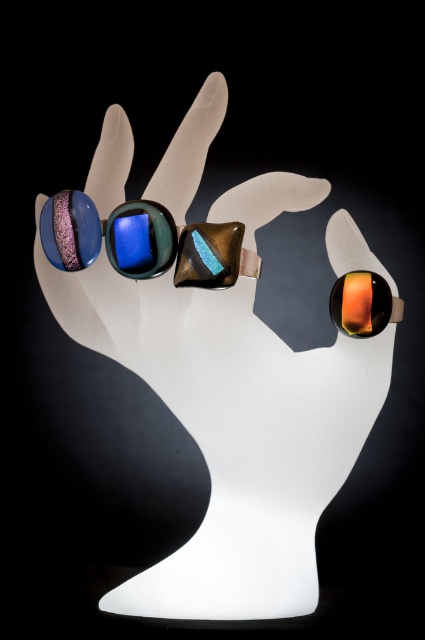
You are standing in front of the mannequin hand displaying rings. There are two points marked on the hand. The first point is at coordinates point (116, 225) and the second point is at point (376, 285). Which point is closer to you?

Point (116, 225) is in front of point (376, 285), so it is closer to you.

You are a jeweler examining the display of rings on the mannequin hand. You notice the shiny blue glass goggles at center and the orange glossy ring at upper right. Which object is closer to you in the image?

The shiny blue glass goggles at center is in front of the orange glossy ring at upper right, so it is closer to you.